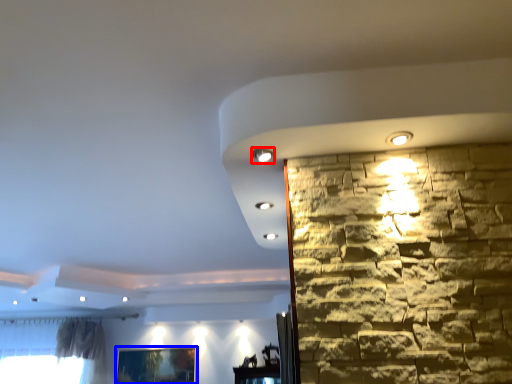
Question: Which object is closer to the camera taking this photo, light (highlighted by a red box) or picture frame (highlighted by a blue box)?

Choices:
 (A) light
 (B) picture frame

Answer: (A)